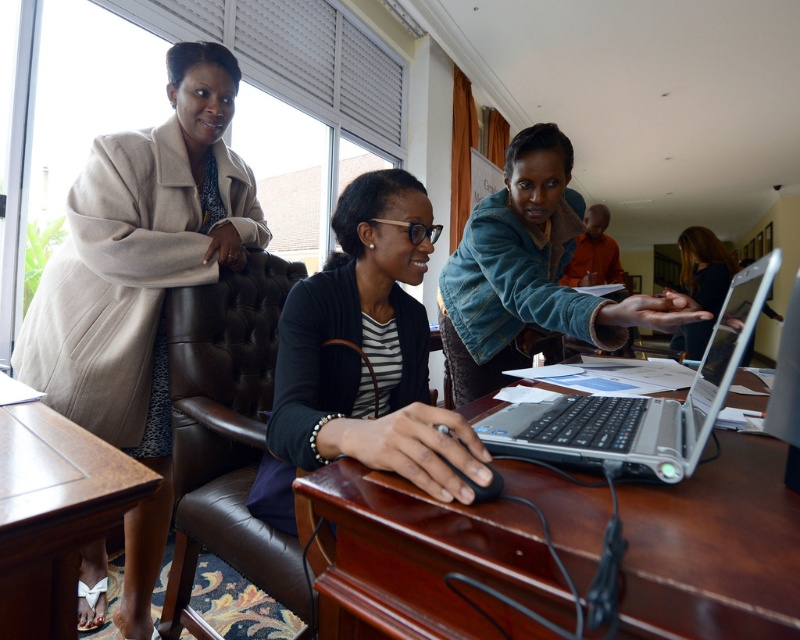
Question: Which point is farther to the camera?

Choices:
 (A) (466, 280)
 (B) (620, 611)

Answer: (A)

Question: Which object appears farthest from the camera in this image?

Choices:
 (A) black matte glasses at center
 (B) brown wooden table at center

Answer: (A)

Question: Does black matte glasses at center have a smaller size compared to brown wood table at lower left?

Choices:
 (A) no
 (B) yes

Answer: (A)

Question: Which point appears farthest from the camera in this image?

Choices:
 (A) (376, 324)
 (B) (74, 461)

Answer: (A)

Question: Can you confirm if denim jacket at upper center is positioned to the right of orange fabric shirt at upper center?

Choices:
 (A) yes
 (B) no

Answer: (B)

Question: Does denim jacket at upper center have a smaller size compared to smooth black hair at center?

Choices:
 (A) no
 (B) yes

Answer: (B)